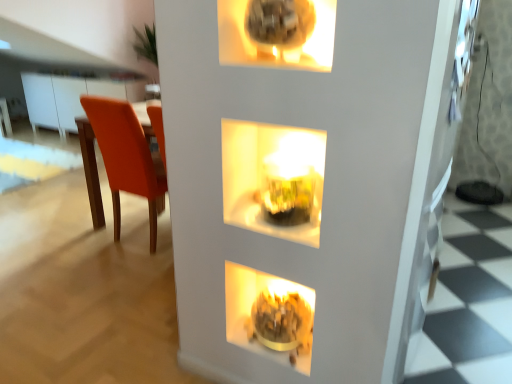
I want to click on free point below translucent glass vase at center (from a real-world perspective), so click(274, 215).